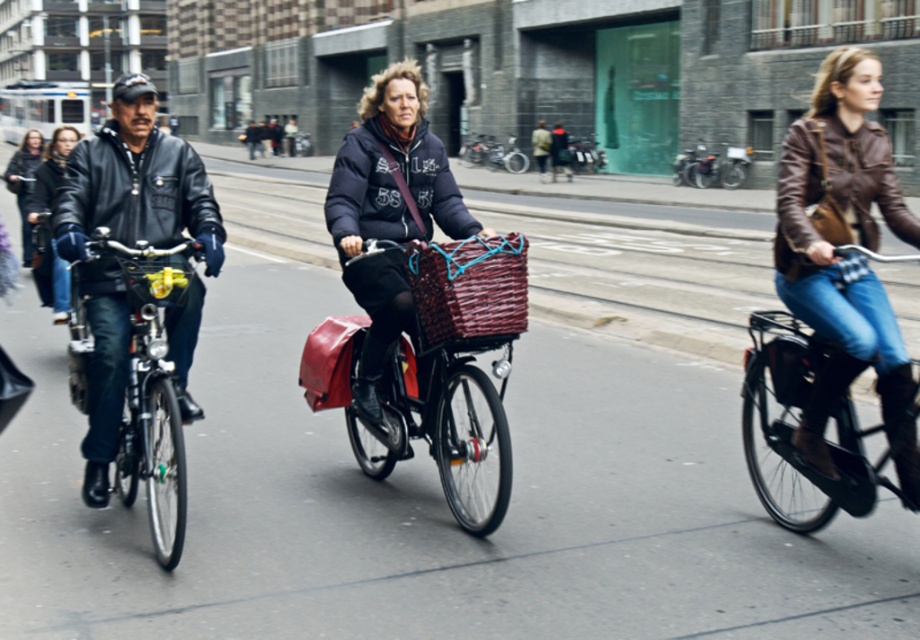
Consider the image. You are a pedestrian standing on the sidewalk and see both the shiny black bicycle at left and the matte black jacket at left. Which one is positioned more to the right from your perspective?

The shiny black bicycle at left is positioned more to the right than the matte black jacket at left.

You are a delivery person trying to locate a cyclist wearing a brown leather jacket in the scene. The cyclist is represented by the point at coordinates [844,257]. Where should you look to find the cyclist?

The cyclist wearing the brown leather jacket is located at the point represented by coordinates [844,257].